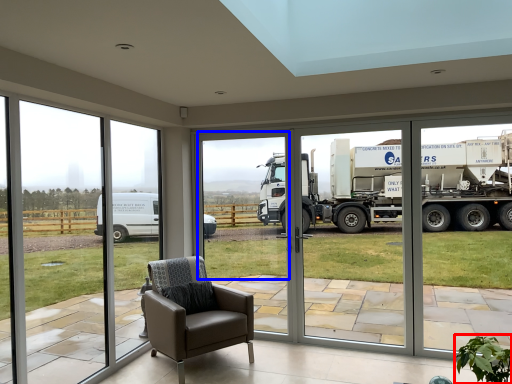
Question: Which of the following is the farthest to the observer, plant (highlighted by a red box) or window screen (highlighted by a blue box)?

Choices:
 (A) plant
 (B) window screen

Answer: (B)